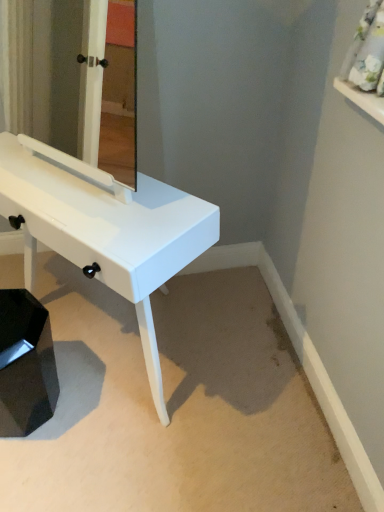
Locate an element on the screen. free space to the right of black glossy step stool at lower left is located at coordinates (92, 400).